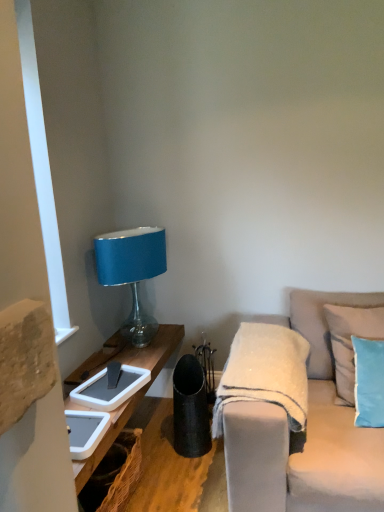
Question: From the image's perspective, is light beige fabric couch at right on white fuzzy blanket at center?

Choices:
 (A) yes
 (B) no

Answer: (B)

Question: Considering the relative sizes of light beige fabric couch at right and white fuzzy blanket at center in the image provided, is light beige fabric couch at right shorter than white fuzzy blanket at center?

Choices:
 (A) yes
 (B) no

Answer: (B)

Question: From the image's perspective, is light beige fabric couch at right located beneath white fuzzy blanket at center?

Choices:
 (A) yes
 (B) no

Answer: (A)

Question: Can you confirm if light beige fabric couch at right is wider than white fuzzy blanket at center?

Choices:
 (A) no
 (B) yes

Answer: (B)

Question: Can you see light beige fabric couch at right touching white fuzzy blanket at center?

Choices:
 (A) no
 (B) yes

Answer: (A)

Question: Looking at their shapes, would you say light beige fabric couch at right is wider or thinner than white fuzzy blanket at center?

Choices:
 (A) wide
 (B) thin

Answer: (A)

Question: Choose the correct answer: Is light beige fabric couch at right inside white fuzzy blanket at center or outside it?

Choices:
 (A) inside
 (B) outside

Answer: (B)

Question: Considering the positions of point (362, 298) and point (253, 362), is point (362, 298) closer or farther from the camera than point (253, 362)?

Choices:
 (A) farther
 (B) closer

Answer: (A)

Question: From their relative heights in the image, would you say light beige fabric couch at right is taller or shorter than white fuzzy blanket at center?

Choices:
 (A) short
 (B) tall

Answer: (B)

Question: Considering the positions of matte blue fabric lampshade at upper left and light beige fabric couch at right in the image, is matte blue fabric lampshade at upper left wider or thinner than light beige fabric couch at right?

Choices:
 (A) thin
 (B) wide

Answer: (A)

Question: In terms of height, does matte blue fabric lampshade at upper left look taller or shorter compared to light beige fabric couch at right?

Choices:
 (A) tall
 (B) short

Answer: (B)

Question: Does point (130, 260) appear closer or farther from the camera than point (382, 467)?

Choices:
 (A) closer
 (B) farther

Answer: (B)

Question: From a real-world perspective, is matte blue fabric lampshade at upper left above or below light beige fabric couch at right?

Choices:
 (A) below
 (B) above

Answer: (B)

Question: Does point (296, 307) appear closer or farther from the camera than point (360, 372)?

Choices:
 (A) closer
 (B) farther

Answer: (B)

Question: From the image's perspective, relative to light blue fabric pillow at right, the first pillow when ordered from front to back, is light beige fabric couch at right above or below?

Choices:
 (A) below
 (B) above

Answer: (A)